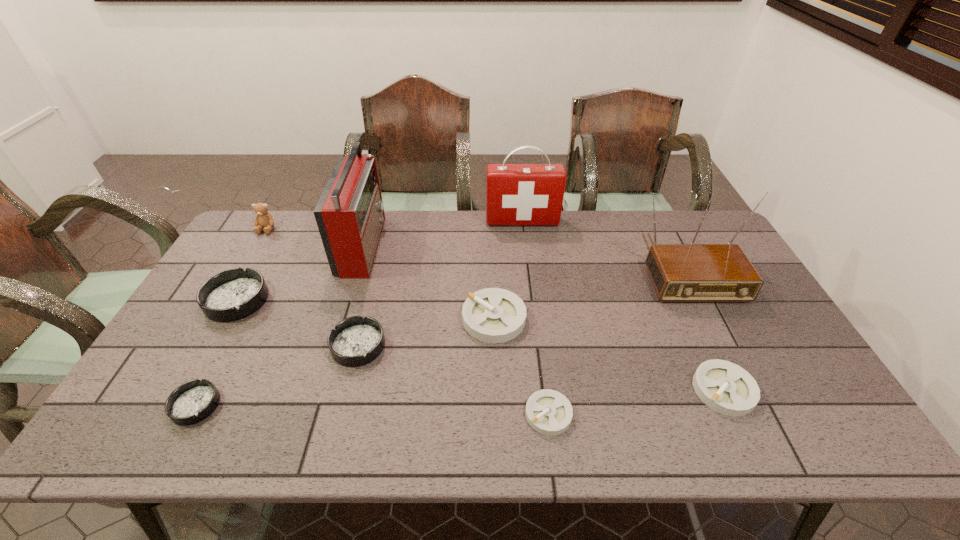
Identify the location of object located in the far right corner section of the desktop. (692, 272).

Locate an element on the screen. The width and height of the screenshot is (960, 540). object that is at the near right corner is located at coordinates (725, 387).

You are a GUI agent. You are given a task and a screenshot of the screen. Output one action in this format:
    pyautogui.click(x=<x>, y=<y>)
    Task: Click on the vacant space at the far edge
    The height and width of the screenshot is (540, 960).
    Given the screenshot: What is the action you would take?
    pyautogui.click(x=582, y=230)

In the image, there is a desktop. Identify the location of free space at the left edge. (261, 258).

I want to click on free space at the right edge, so click(x=735, y=318).

This screenshot has width=960, height=540. Find the location of `vacant space at the near right corner`. vacant space at the near right corner is located at coordinates (794, 414).

You are a GUI agent. You are given a task and a screenshot of the screen. Output one action in this format:
    pyautogui.click(x=<x>, y=<y>)
    Task: Click on the vacant space that is in between the right radio_receiver and the smallest dark ashtray
    
    Given the screenshot: What is the action you would take?
    pyautogui.click(x=440, y=336)

Locate an element on the screen. free spot between the right radio_receiver and the nearest dark ashtray is located at coordinates (440, 336).

This screenshot has height=540, width=960. Identify the location of unoccupied area between the farthest dark ashtray and the farthest gray ashtray. (366, 309).

I want to click on free area in between the right radio_receiver and the biggest gray ashtray, so click(588, 292).